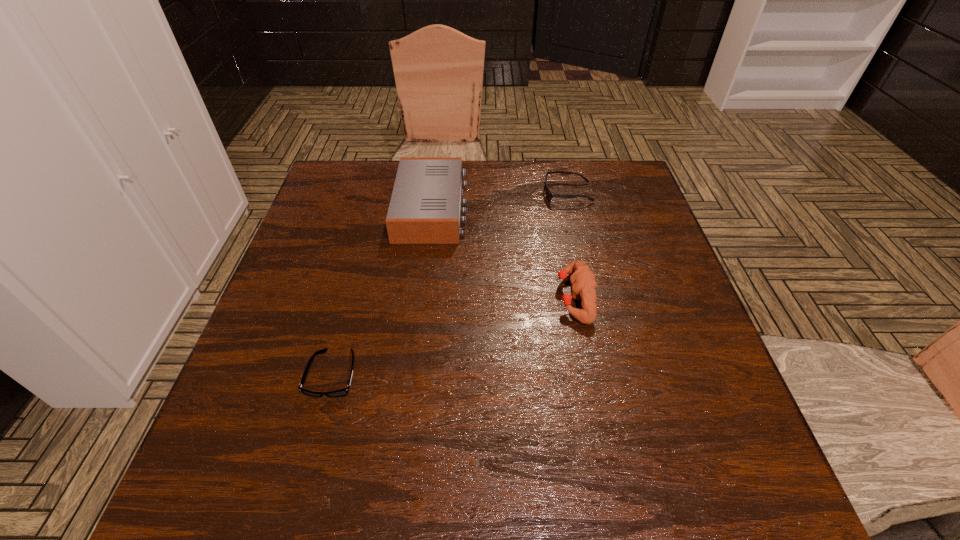
Locate an element on the screen. the third object from right to left is located at coordinates (425, 208).

Image resolution: width=960 pixels, height=540 pixels. Find the location of `the third farthest object`. the third farthest object is located at coordinates (583, 282).

Locate an element on the screen. the third tallest object is located at coordinates (549, 194).

Where is `the farther sunglasses`? The image size is (960, 540). the farther sunglasses is located at coordinates (549, 194).

Locate an element on the screen. Image resolution: width=960 pixels, height=540 pixels. the shorter sunglasses is located at coordinates (342, 392).

The height and width of the screenshot is (540, 960). What are the coordinates of `the left sunglasses` in the screenshot? It's located at (342, 392).

You are a GUI agent. You are given a task and a screenshot of the screen. Output one action in this format:
    pyautogui.click(x=<x>, y=<y>)
    Task: Click on the vacant area located 0.100m on the front panel of the radio receiver
    This screenshot has width=960, height=540.
    Given the screenshot: What is the action you would take?
    pyautogui.click(x=503, y=208)

Find the location of a particular element. vacant space located with the gloves of the second nearest object facing forward is located at coordinates (464, 297).

Find the location of a particular element. This screenshot has width=960, height=540. free space located with the gloves of the second nearest object facing forward is located at coordinates (504, 297).

Identify the location of vacant space situated with the gloves of the second nearest object facing forward. (499, 297).